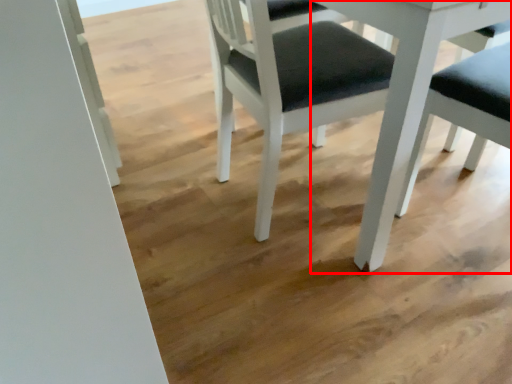
Question: Where is table (annotated by the red box) located in relation to chair in the image?

Choices:
 (A) left
 (B) right

Answer: (B)